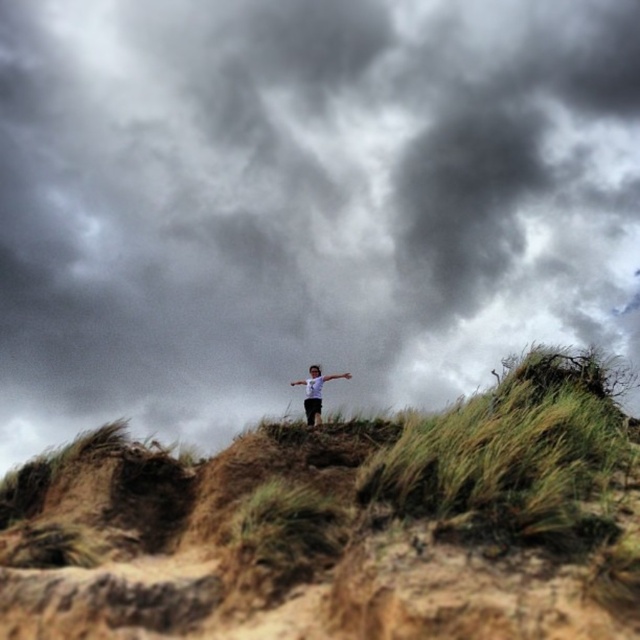
Is dark gray cloud at upper center positioned behind brown grassy hillside at center?

No, it is in front of brown grassy hillside at center.

Between dark gray cloud at upper center and brown grassy hillside at center, which one appears on the left side from the viewer's perspective?

Positioned to the left is brown grassy hillside at center.

Which is in front, point (566, 320) or point (493, 493)?

Point (493, 493)

Locate an element on the screen. The height and width of the screenshot is (640, 640). dark gray cloud at upper center is located at coordinates (305, 204).

Who is positioned more to the left, dark gray cloud at upper center or white matte shirt at center?

white matte shirt at center is more to the left.

Find the location of a particular element. The height and width of the screenshot is (640, 640). dark gray cloud at upper center is located at coordinates (305, 204).

This screenshot has height=640, width=640. What do you see at coordinates (305, 204) in the screenshot?
I see `dark gray cloud at upper center` at bounding box center [305, 204].

You are a GUI agent. You are given a task and a screenshot of the screen. Output one action in this format:
    pyautogui.click(x=<x>, y=<y>)
    Task: Click on the dark gray cloud at upper center
    The width and height of the screenshot is (640, 640).
    Given the screenshot: What is the action you would take?
    pyautogui.click(x=305, y=204)

Can you confirm if brown grassy hillside at center is thinner than white matte shirt at center?

Indeed, brown grassy hillside at center has a lesser width compared to white matte shirt at center.

From the picture: Between brown grassy hillside at center and white matte shirt at center, which one is positioned lower?

brown grassy hillside at center is lower down.

Is point (401, 602) positioned after point (312, 364)?

That is False.

This screenshot has height=640, width=640. In order to click on brown grassy hillside at center in this screenshot , I will do `click(344, 524)`.